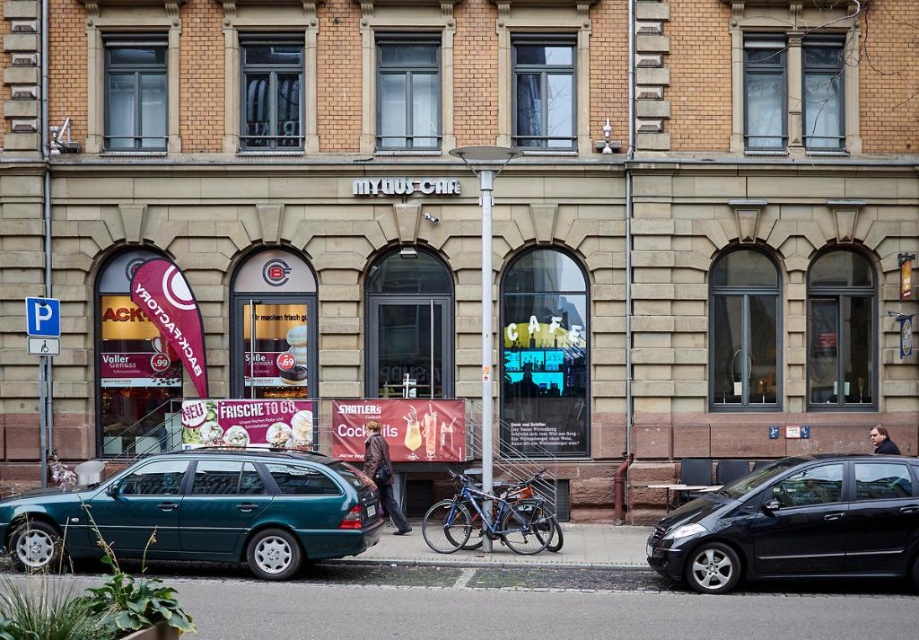
Can you confirm if teal metallic station wagon at lower left is wider than black matte car at right?

Yes.

Is teal metallic station wagon at lower left positioned at the back of black matte car at right?

Yes, teal metallic station wagon at lower left is behind black matte car at right.

Where is `teal metallic station wagon at lower left`? This screenshot has width=919, height=640. teal metallic station wagon at lower left is located at coordinates (202, 513).